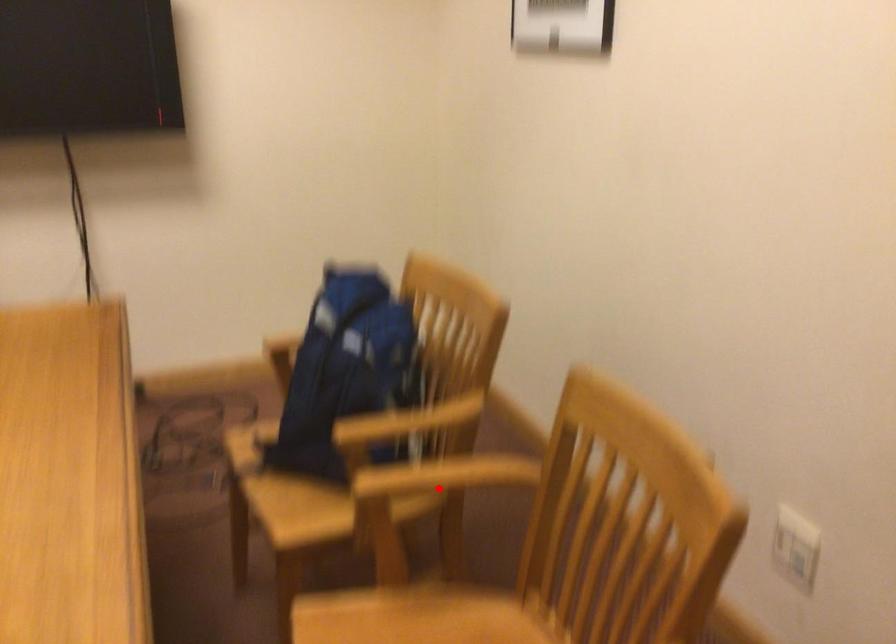
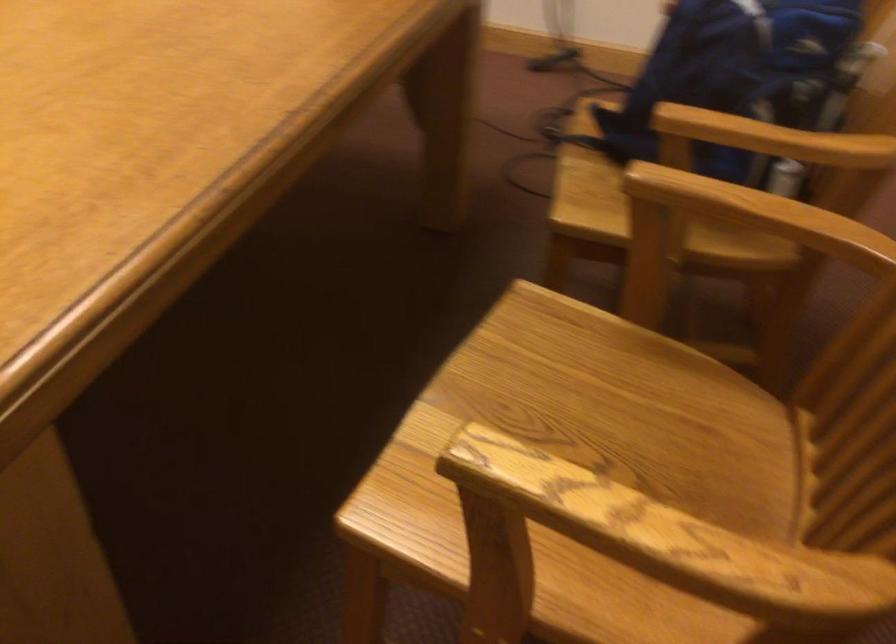
Question: I am providing you with two images of the same scene from different viewpoints. A red point is shown in image1. For the corresponding object point in image2, is it positioned nearer or farther from the camera?

Choices:
 (A) Nearer
 (B) Farther

Answer: (A)